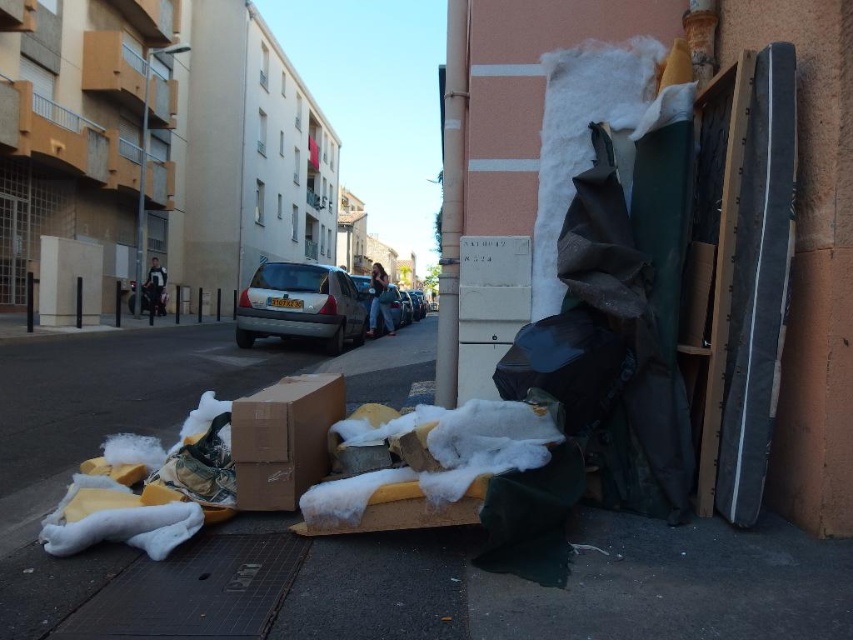
Question: Which object is the closest to the matte gray hatchback at center?

Choices:
 (A) brown cardboard box at lower center
 (B) white foam at lower left

Answer: (B)

Question: Does brown cardboard box at lower center have a lesser width compared to matte gray hatchback at center?

Choices:
 (A) yes
 (B) no

Answer: (A)

Question: Which object appears farthest from the camera in this image?

Choices:
 (A) white foam at lower left
 (B) brown cardboard box at lower center
 (C) matte gray hatchback at center

Answer: (C)

Question: Is white foam at lower left to the left of brown cardboard box at lower center from the viewer's perspective?

Choices:
 (A) no
 (B) yes

Answer: (B)

Question: Which of the following is the farthest from the observer?

Choices:
 (A) white foam at lower left
 (B) matte gray hatchback at center

Answer: (B)

Question: Is white foam at lower left bigger than brown cardboard box at lower center?

Choices:
 (A) yes
 (B) no

Answer: (A)